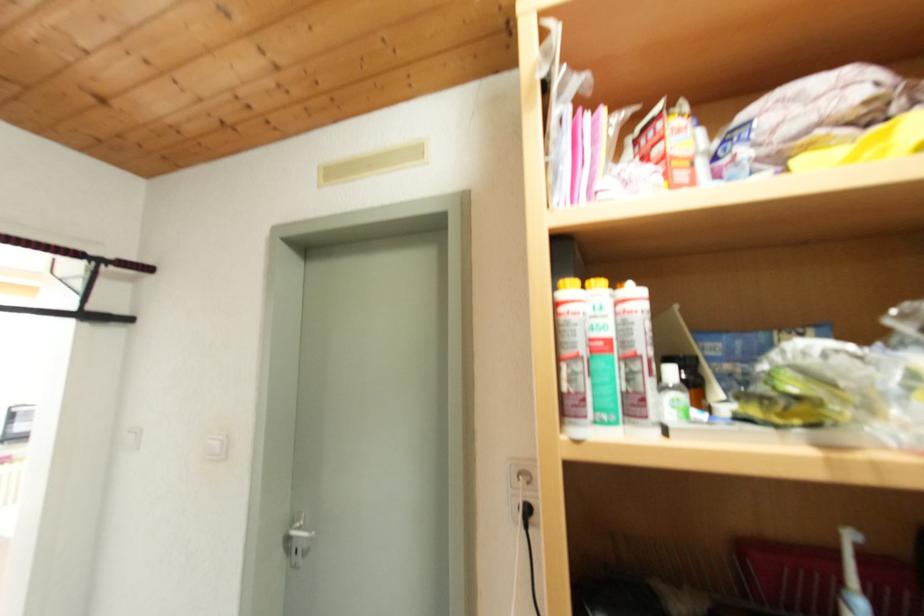
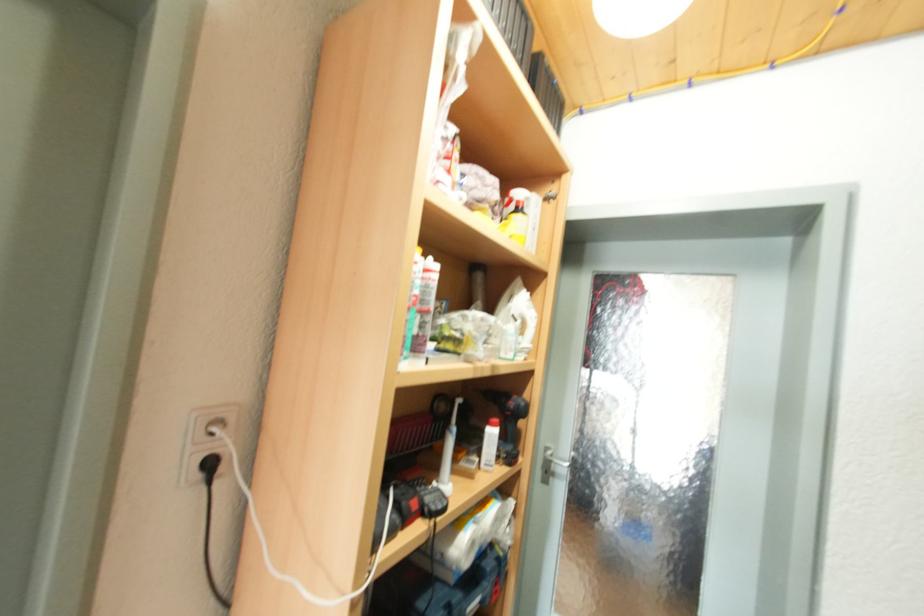
Question: The camera is either moving clockwise (left) or counter-clockwise (right) around the object. The first image is from the beginning of the video and the second image is from the end. Is the camera moving left or right when shooting the video?

Choices:
 (A) Left
 (B) Right

Answer: (A)